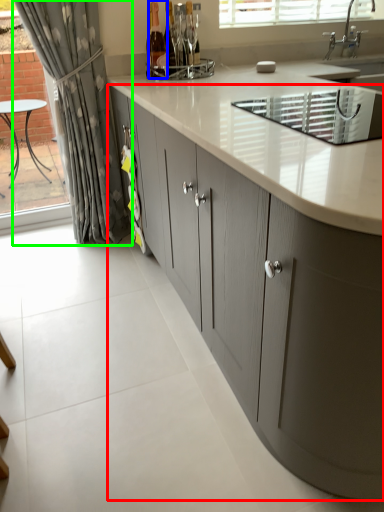
Question: Considering the real-world distances, which object is farthest from cabinetry (highlighted by a red box)? bottle (highlighted by a blue box) or curtain (highlighted by a green box)?

Choices:
 (A) bottle
 (B) curtain

Answer: (A)